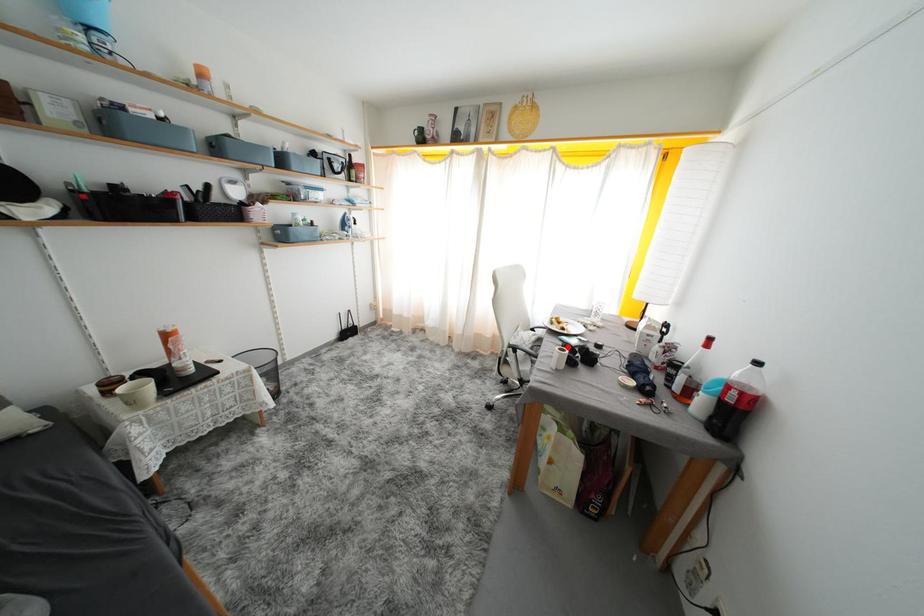
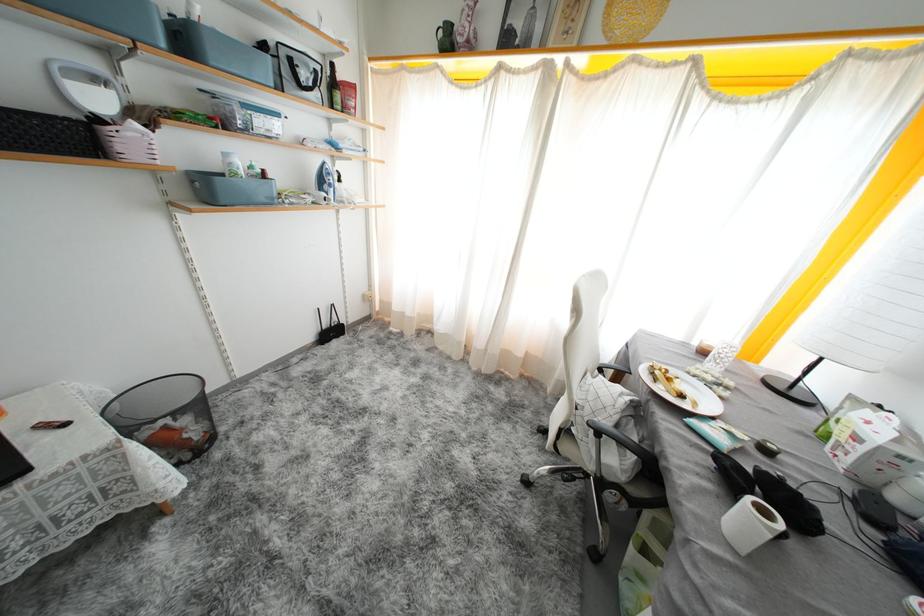
Question: I am providing you with two images of the same scene from different viewpoints. In image1, a red point is highlighted. Considering the same 3D point in image2, which of the following is correct?

Choices:
 (A) It is closer
 (B) It is farther

Answer: (B)